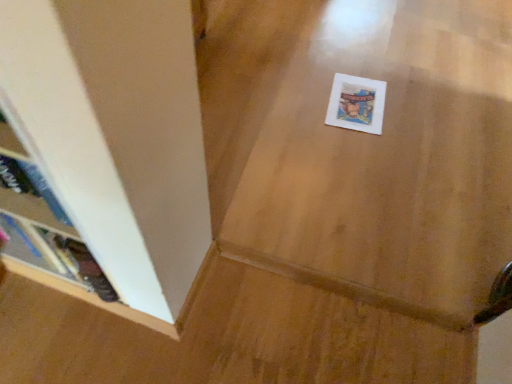
Find the location of a particular element. free space to the left of white paper postcard at center is located at coordinates (302, 98).